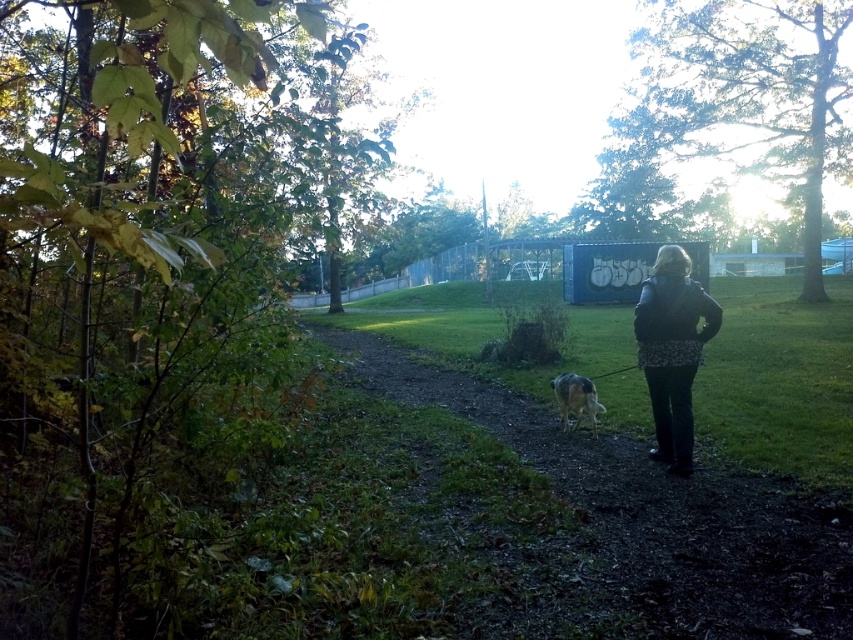
Question: Is dirt path at center to the right of fuzzy brown dog at center from the viewer's perspective?

Choices:
 (A) yes
 (B) no

Answer: (B)

Question: Which object is the closest to the dirt path at center?

Choices:
 (A) dark blue leather jacket at right
 (B) fuzzy brown dog at center

Answer: (B)

Question: Does dirt path at center appear over dark blue leather jacket at right?

Choices:
 (A) no
 (B) yes

Answer: (A)

Question: Among these points, which one is farthest from the camera?

Choices:
 (A) (660, 417)
 (B) (576, 374)

Answer: (B)

Question: Which object is positioned farthest from the dirt path at center?

Choices:
 (A) fuzzy brown dog at center
 (B) dark blue leather jacket at right

Answer: (B)

Question: Is dark blue leather jacket at right wider than fuzzy brown dog at center?

Choices:
 (A) yes
 (B) no

Answer: (A)